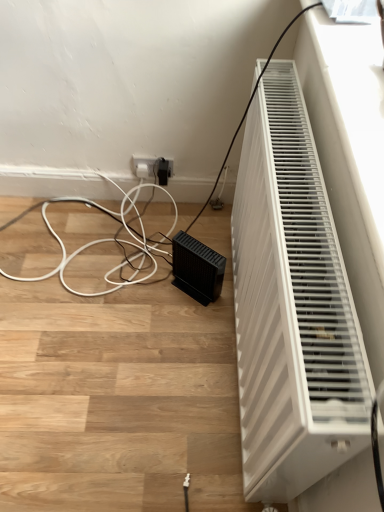
Identify the location of free point in front of black matte speaker at lower center. The image size is (384, 512). (190, 326).